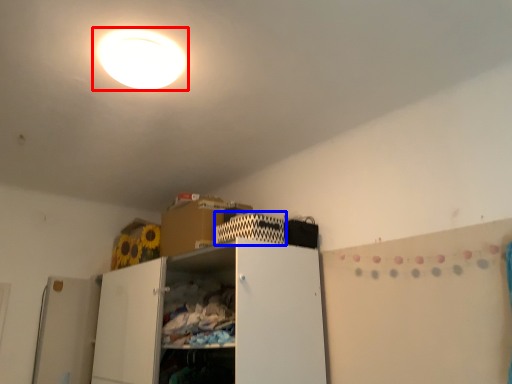
Question: Which object appears farthest to the camera in this image, lamp (highlighted by a red box) or cabinet (highlighted by a blue box)?

Choices:
 (A) lamp
 (B) cabinet

Answer: (B)